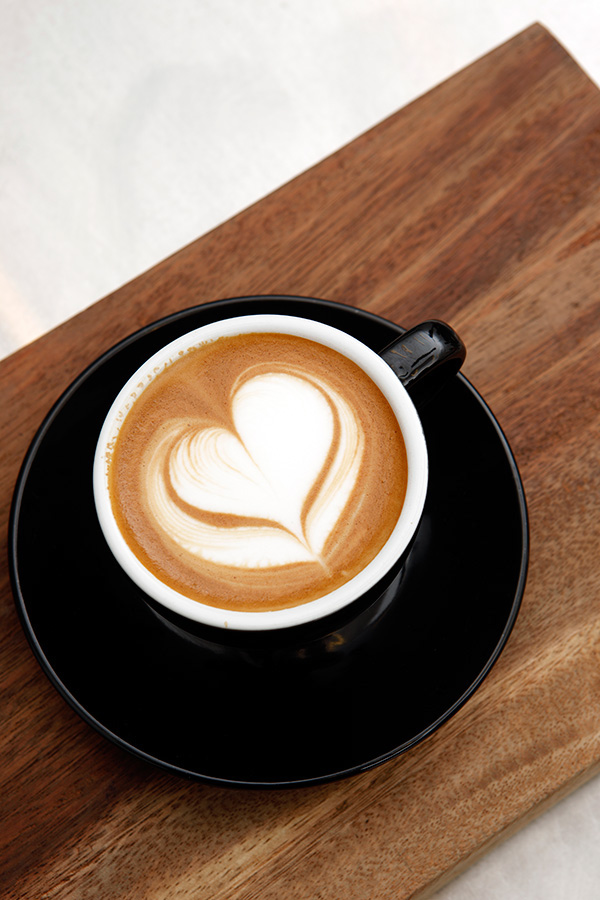
This screenshot has width=600, height=900. In order to click on other surface in this screenshot , I will do `click(544, 852)`, `click(114, 250)`.